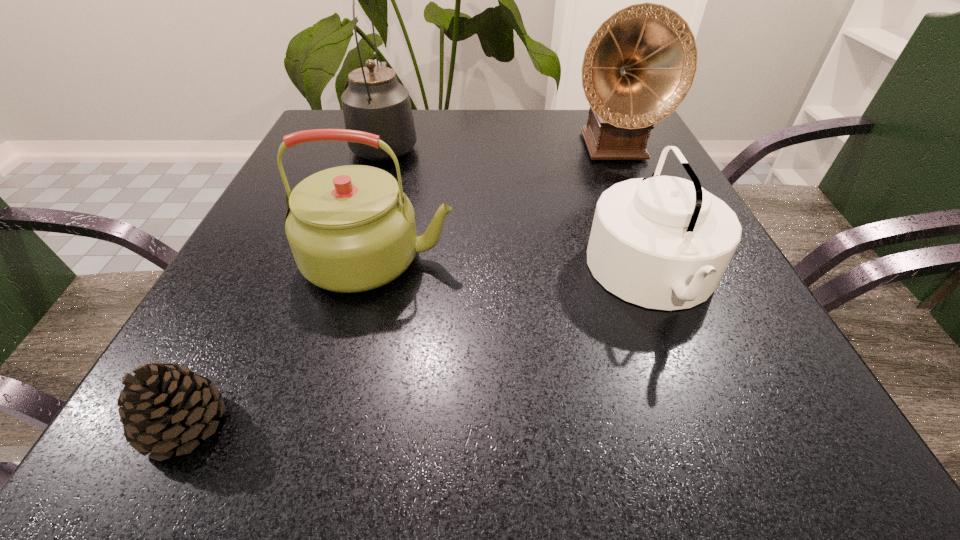
What are the coordinates of `free spot that satisfies the following two spatial constraints: 1. on the horn of the phonograph record; 2. at the spout of the third shortest object` in the screenshot? It's located at coord(662,258).

Where is `vacant region that satisfies the following two spatial constraints: 1. at the spout of the second tallest kettle; 2. at the narrow end of the pinecone`? The image size is (960, 540). vacant region that satisfies the following two spatial constraints: 1. at the spout of the second tallest kettle; 2. at the narrow end of the pinecone is located at coordinates (337, 424).